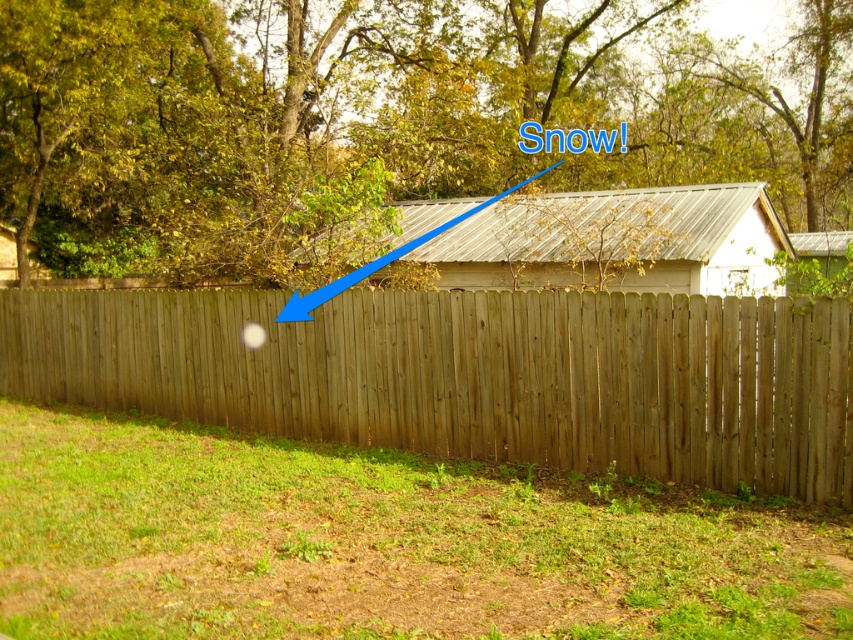
Between wooden fence at center and wooden fence at lower left, which one appears on the right side from the viewer's perspective?

wooden fence at lower left

Does wooden fence at center have a lesser width compared to wooden fence at lower left?

No, wooden fence at center is not thinner than wooden fence at lower left.

Image resolution: width=853 pixels, height=640 pixels. Describe the element at coordinates (474, 376) in the screenshot. I see `wooden fence at center` at that location.

The image size is (853, 640). I want to click on wooden fence at center, so click(474, 376).

Can you confirm if wooden fence at center is positioned above metallic gray hut at center?

No, wooden fence at center is not above metallic gray hut at center.

This screenshot has height=640, width=853. What do you see at coordinates (474, 376) in the screenshot?
I see `wooden fence at center` at bounding box center [474, 376].

Which is behind, point (668, 442) or point (695, 276)?

The point (695, 276) is behind.

Locate an element on the screen. Image resolution: width=853 pixels, height=640 pixels. wooden fence at center is located at coordinates (474, 376).

Does metallic gray hut at center have a larger size compared to wooden fence at lower left?

Actually, metallic gray hut at center might be smaller than wooden fence at lower left.

Measure the distance from metallic gray hut at center to wooden fence at lower left.

metallic gray hut at center is 2.65 meters away from wooden fence at lower left.

Describe the element at coordinates (593, 241) in the screenshot. The height and width of the screenshot is (640, 853). I see `metallic gray hut at center` at that location.

The height and width of the screenshot is (640, 853). Identify the location of metallic gray hut at center. (593, 241).